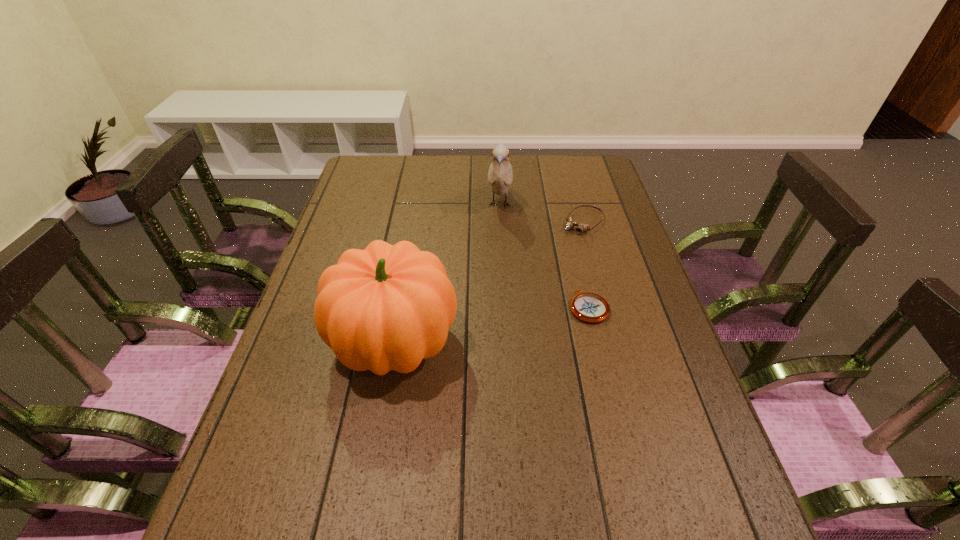
Where is `pumpkin`? The image size is (960, 540). pumpkin is located at coordinates (387, 307).

What are the coordinates of `the shortest object` in the screenshot? It's located at (590, 307).

In order to click on goggles in this screenshot , I will do `click(570, 224)`.

The width and height of the screenshot is (960, 540). In order to click on bird in this screenshot , I will do coord(500,175).

I want to click on vacant area located on the back of the pumpkin, so click(x=418, y=212).

Identify the location of vacant space positioned 0.120m on the left of the shortest object. (522, 307).

Where is `free space located on the front lenses and sides of the goggles`? The height and width of the screenshot is (540, 960). free space located on the front lenses and sides of the goggles is located at coordinates (520, 287).

At what (x,y) coordinates should I click in order to perform the action: click on blank area located on the front lenses and sides of the goggles. Please return your answer as a coordinate pair (x, y). Looking at the image, I should click on click(525, 282).

I want to click on vacant area located on the front lenses and sides of the goggles, so click(558, 248).

You are a GUI agent. You are given a task and a screenshot of the screen. Output one action in this format:
    pyautogui.click(x=<x>, y=<y>)
    Task: Click on the free space located 0.170m at the beak of the third object from right to left
    This screenshot has height=540, width=960.
    Given the screenshot: What is the action you would take?
    pyautogui.click(x=496, y=260)